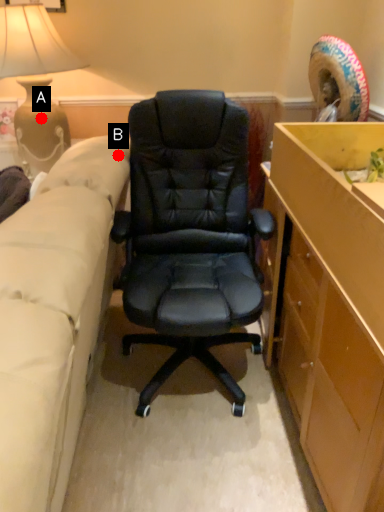
Question: Two points are circled on the image, labeled by A and B beside each circle. Which point is farther to the camera?

Choices:
 (A) A is further
 (B) B is further

Answer: (A)